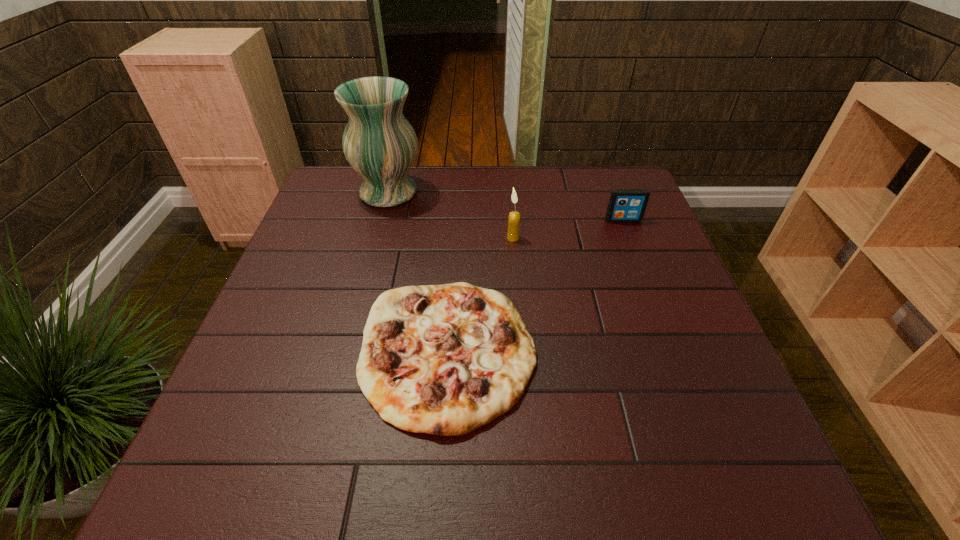
I want to click on the tallest object, so click(379, 143).

I want to click on vase, so coord(379,143).

The image size is (960, 540). What are the coordinates of `the second tallest object` in the screenshot? It's located at (514, 217).

Locate an element on the screen. The image size is (960, 540). candle is located at coordinates (514, 217).

In order to click on the rightmost object in this screenshot , I will do click(625, 205).

At what (x,y) coordinates should I click in order to perform the action: click on the third tallest object. Please return your answer as a coordinate pair (x, y). Image resolution: width=960 pixels, height=540 pixels. Looking at the image, I should click on (625, 205).

Locate an element on the screen. Image resolution: width=960 pixels, height=540 pixels. the shortest object is located at coordinates (446, 359).

Find the location of a particular element. The image size is (960, 540). the nearest object is located at coordinates (446, 359).

I want to click on free space located on the left of the vase, so click(x=334, y=192).

Identify the location of free space located 0.160m on the left of the candle. (447, 238).